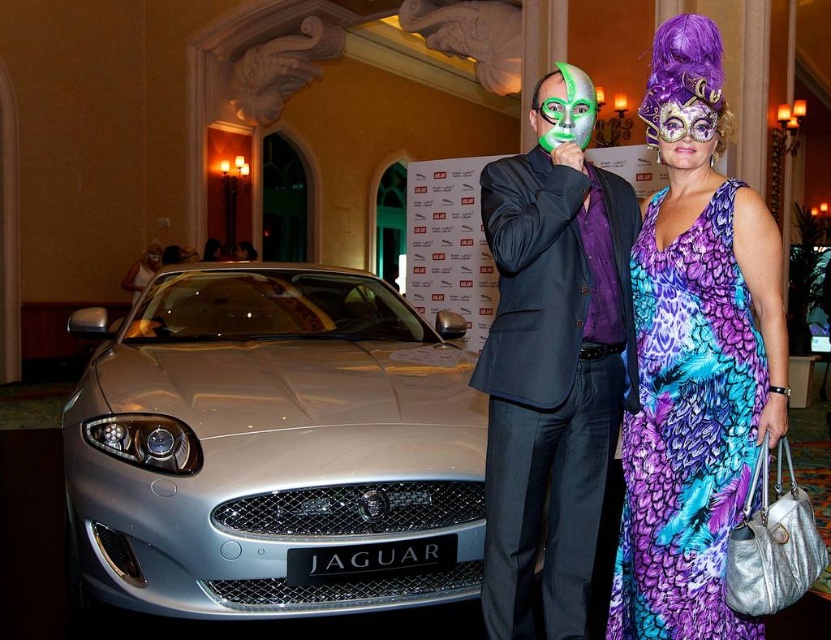
Question: Considering the real-world distances, which object is closest to the matte black suit at center?

Choices:
 (A) green matte mask at center
 (B) purple printed dress at right
 (C) metallic silver car at left
 (D) silver metallic jaguar at center

Answer: (B)

Question: Considering the real-world distances, which object is farthest from the matte black suit at center?

Choices:
 (A) purple printed dress at right
 (B) green matte mask at center
 (C) silver metallic jaguar at center
 (D) metallic silver car at left

Answer: (C)

Question: Among these objects, which one is nearest to the camera?

Choices:
 (A) green matte mask at center
 (B) silver metallic jaguar at center

Answer: (A)

Question: Is the position of silver metallic jaguar at center less distant than that of matte black suit at center?

Choices:
 (A) no
 (B) yes

Answer: (A)

Question: Considering the relative positions of matte black suit at center and purple shiny mask at upper right in the image provided, where is matte black suit at center located with respect to purple shiny mask at upper right?

Choices:
 (A) below
 (B) above

Answer: (A)

Question: Can you confirm if metallic silver car at left is positioned above purple printed dress at right?

Choices:
 (A) no
 (B) yes

Answer: (B)